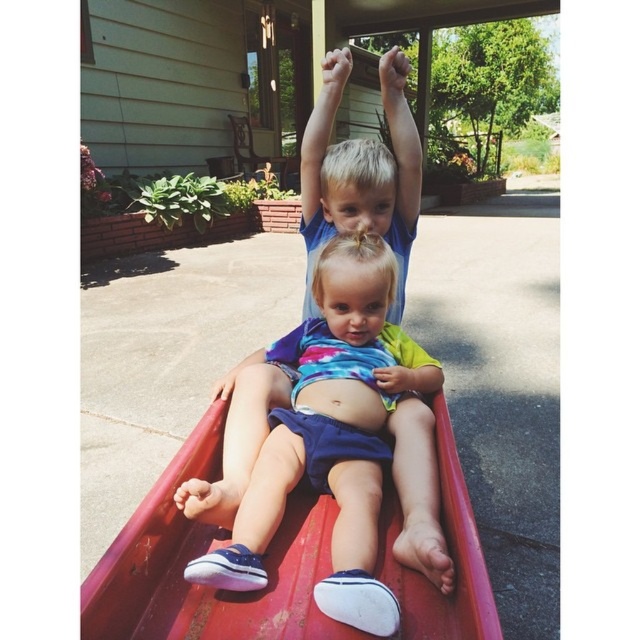
Question: Does matte blue shorts at center appear over metallic red slide at center?

Choices:
 (A) yes
 (B) no

Answer: (A)

Question: Which object is farther from the camera taking this photo?

Choices:
 (A) matte blue shorts at center
 (B) metallic red slide at center

Answer: (A)

Question: Does matte blue shorts at center appear on the right side of metallic red slide at center?

Choices:
 (A) no
 (B) yes

Answer: (B)

Question: Which of the following is the farthest from the observer?

Choices:
 (A) metallic red slide at center
 (B) matte blue shorts at center

Answer: (B)

Question: Does matte blue shorts at center have a lesser width compared to metallic red slide at center?

Choices:
 (A) no
 (B) yes

Answer: (B)